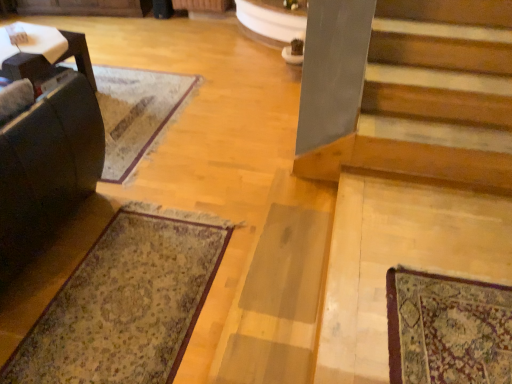
Question: Would you say wooden stairs at lower right is to the left or to the right of patterned carpet at lower left in the picture?

Choices:
 (A) left
 (B) right

Answer: (B)

Question: Based on their sizes in the image, would you say wooden stairs at lower right is bigger or smaller than patterned carpet at lower left?

Choices:
 (A) big
 (B) small

Answer: (A)

Question: Which of these objects is positioned closest to the dark brown leather rocking chair at left?

Choices:
 (A) patterned carpet at lower left
 (B) wooden stairs at lower right

Answer: (A)

Question: Which object is the farthest from the wooden stairs at lower right?

Choices:
 (A) dark brown leather rocking chair at left
 (B) patterned carpet at lower left

Answer: (A)